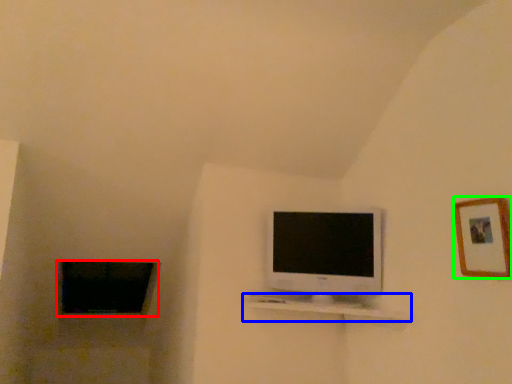
Question: Considering the real-world distances, which object is closest to window (highlighted by a red box)? shelf (highlighted by a blue box) or picture frame (highlighted by a green box).

Choices:
 (A) shelf
 (B) picture frame

Answer: (A)